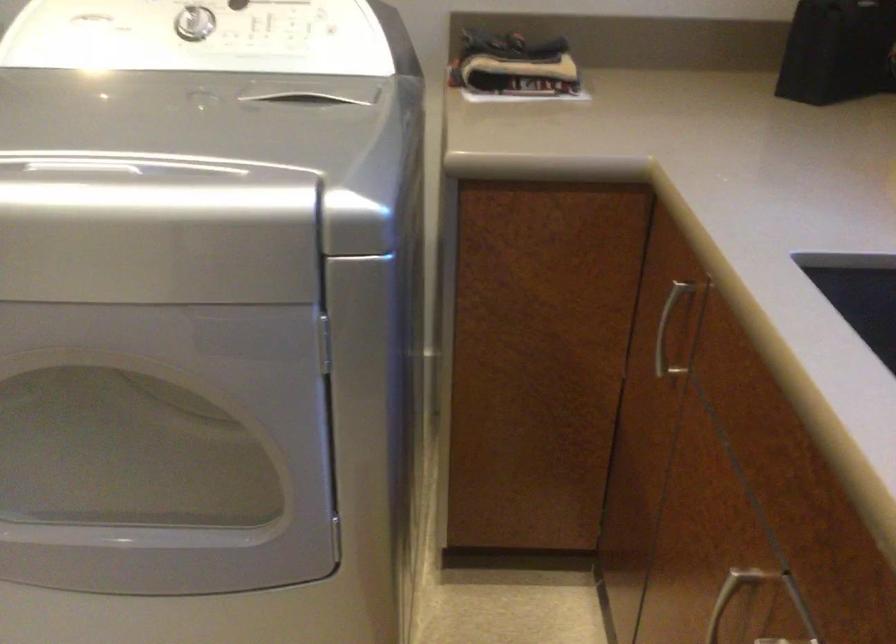
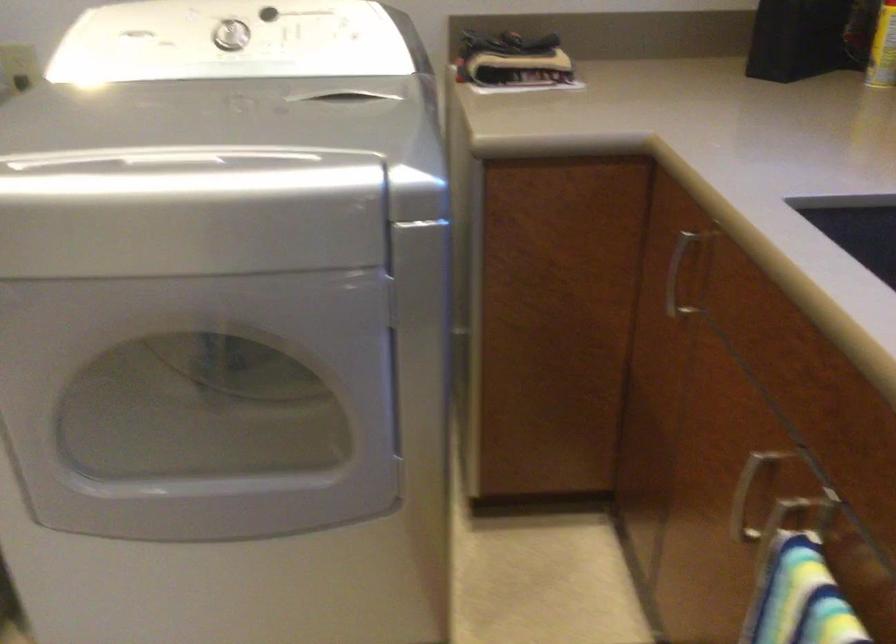
Locate, in the second image, the point that corresponds to (91,167) in the first image.

(178, 160)